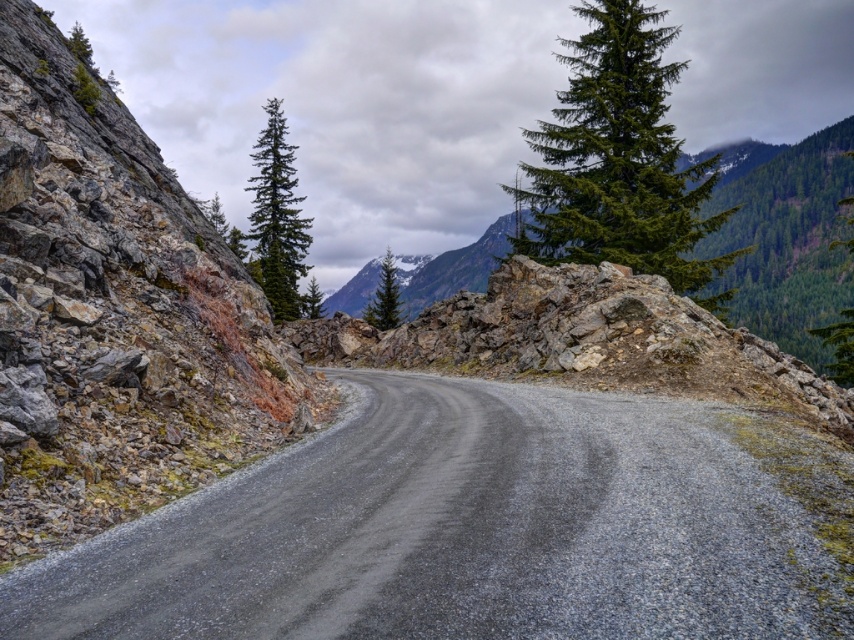
Question: Which point is closer to the camera?

Choices:
 (A) rocky gray at left
 (B) gray asphalt road at center

Answer: (B)

Question: Is rocky gray at left in front of green matte tree at center?

Choices:
 (A) yes
 (B) no

Answer: (A)

Question: Does rocky gray at left lie in front of green needle-like tree at upper center?

Choices:
 (A) no
 (B) yes

Answer: (B)

Question: Which object is farther from the camera taking this photo?

Choices:
 (A) gray asphalt road at center
 (B) green matte evergreen tree at center
 (C) rocky gray at left

Answer: (B)

Question: Which point is farther to the camera?

Choices:
 (A) (600, 168)
 (B) (455, 404)
 (C) (284, 144)
 (D) (199, 321)

Answer: (C)

Question: Does green needle-like tree at upper center appear under green matte tree at center?

Choices:
 (A) no
 (B) yes

Answer: (A)